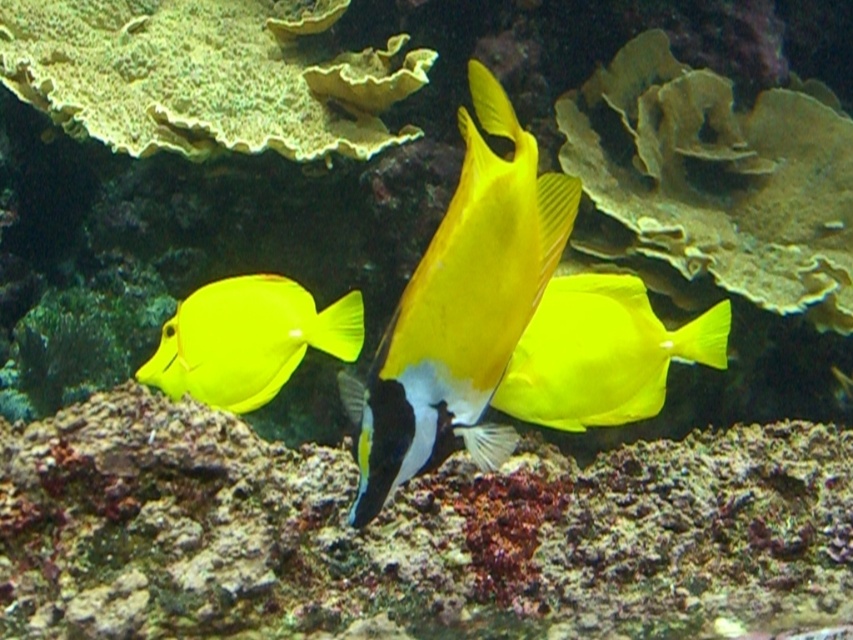
Question: Among these points, which one is nearest to the camera?

Choices:
 (A) (538, 355)
 (B) (282, 365)
 (C) (369, 436)

Answer: (C)

Question: Can you confirm if yellow matte fish at center is bigger than matte yellow fish at left?

Choices:
 (A) yes
 (B) no

Answer: (A)

Question: Can you confirm if matte yellow fish at center is positioned below matte yellow fish at left?

Choices:
 (A) yes
 (B) no

Answer: (B)

Question: Which of these objects is positioned farthest from the matte yellow fish at center?

Choices:
 (A) matte yellow fish at left
 (B) yellow matte fish at center

Answer: (B)

Question: Which object is the farthest from the matte yellow fish at left?

Choices:
 (A) matte yellow fish at center
 (B) yellow matte fish at center

Answer: (B)

Question: Can you confirm if yellow matte fish at center is thinner than matte yellow fish at center?

Choices:
 (A) yes
 (B) no

Answer: (A)